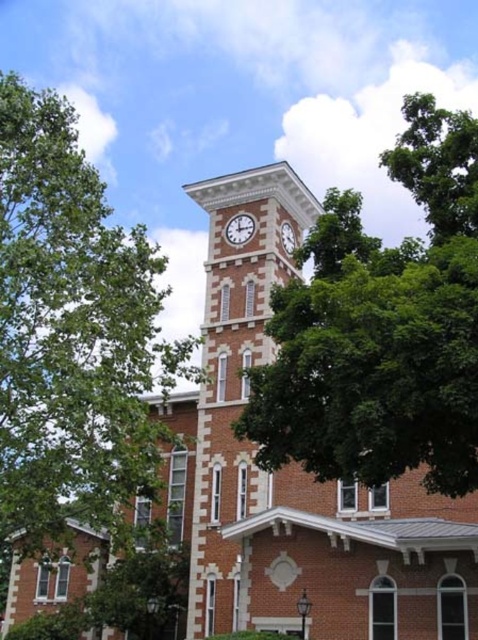
You are standing in front of the historic brick clock tower and notice the green leafy tree at left and the white brick clock at upper center. From your perspective, which object is positioned to the left?

The green leafy tree at left is positioned to the left of the white brick clock at upper center.

You are an architect examining the historic brick clock tower. You notice two clocks on the tower. One is labeled as the white brick clock at upper center and the other as the white stone clock at upper center. Which clock is taller?

The white brick clock at upper center is taller than the white stone clock at upper center according to the description provided.

You are a city planner assessing the visibility of the clock tower from a nearby park. The park is 25 meters away from the clock tower. Considering the green leafy tree at upper center and the white brick clock at upper center, will the tree block the view of the clock face from the park?

The green leafy tree at upper center and white brick clock at upper center are 23.50 meters apart. Since the park is 25 meters away from the clock tower, the tree is closer to the clock than the park. Therefore, the tree will block the view of the clock face from the park.